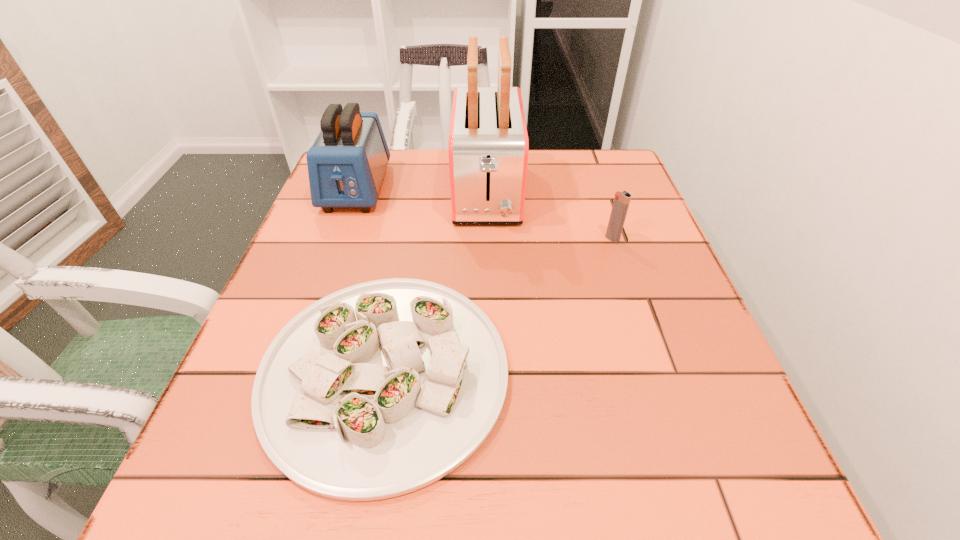
Find the location of a particular element. The image size is (960, 540). vacant space at the left edge is located at coordinates (355, 272).

Where is `free space at the right edge of the desktop`? This screenshot has width=960, height=540. free space at the right edge of the desktop is located at coordinates (676, 418).

In the image, there is a desktop. Where is `free region at the near left corner`? free region at the near left corner is located at coordinates (220, 523).

The image size is (960, 540). In the image, there is a desktop. Find the location of `free space at the far right corner`. free space at the far right corner is located at coordinates (609, 156).

Identify the location of vacant area that lies between the nearest object and the second shortest object. The image size is (960, 540). (498, 305).

The height and width of the screenshot is (540, 960). Identify the location of free space between the third tallest object and the shortest object. (498, 305).

This screenshot has height=540, width=960. I want to click on empty space between the rightmost object and the nearest object, so click(x=498, y=305).

Locate an element on the screen. vacant space that is in between the shorter toaster and the right toaster is located at coordinates (421, 191).

What are the coordinates of `vacant area that lies between the third shortest object and the nearest object` in the screenshot? It's located at (371, 280).

The image size is (960, 540). Find the location of `empty space between the rightmost object and the right toaster`. empty space between the rightmost object and the right toaster is located at coordinates (549, 216).